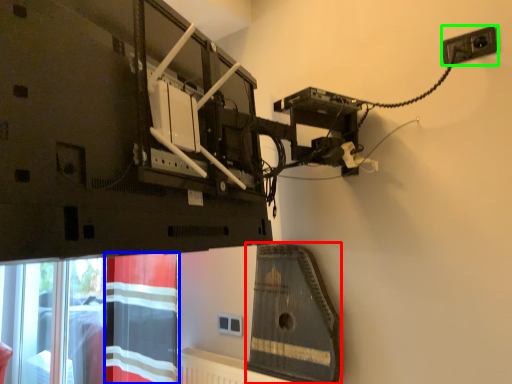
Question: Which object is positioned closest to instrument (highlighted by a red box)? Select from curtain (highlighted by a blue box) and power plugs and sockets (highlighted by a green box).

Choices:
 (A) curtain
 (B) power plugs and sockets

Answer: (A)